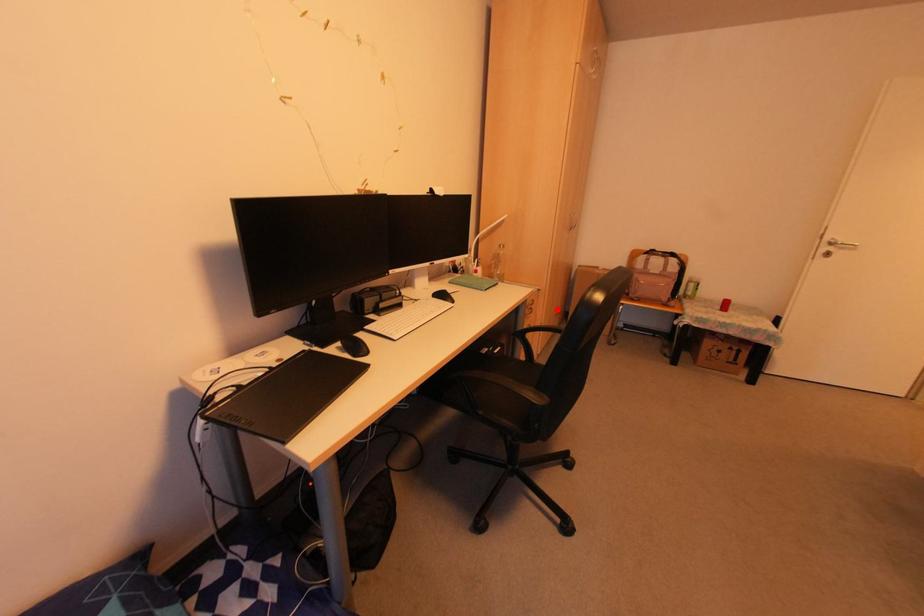
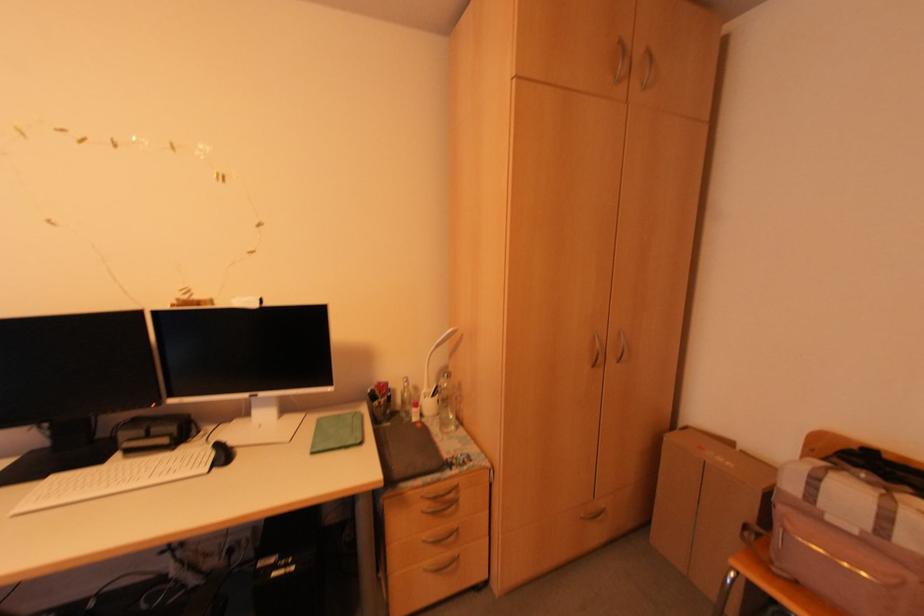
Locate, in the second image, the point that corresponds to the highlighted location in the first image.

(602, 506)